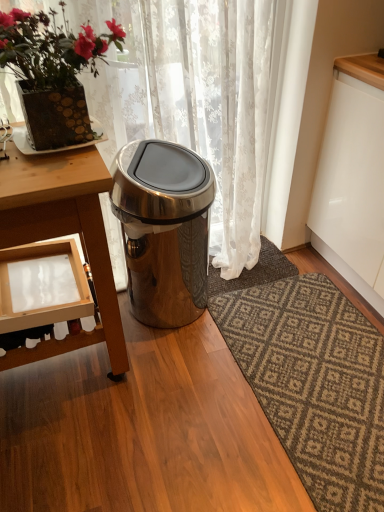
Question: Can you confirm if white lace curtain at upper center is smaller than dark gray textured rug at center?

Choices:
 (A) no
 (B) yes

Answer: (A)

Question: Can you confirm if white lace curtain at upper center is bigger than dark gray textured rug at center?

Choices:
 (A) no
 (B) yes

Answer: (B)

Question: Considering the relative sizes of white lace curtain at upper center and dark gray textured rug at center in the image provided, is white lace curtain at upper center thinner than dark gray textured rug at center?

Choices:
 (A) yes
 (B) no

Answer: (A)

Question: From the image's perspective, is white lace curtain at upper center located above dark gray textured rug at center?

Choices:
 (A) yes
 (B) no

Answer: (A)

Question: Are white lace curtain at upper center and dark gray textured rug at center located far from each other?

Choices:
 (A) yes
 (B) no

Answer: (B)

Question: From the image's perspective, is matte gold pot at upper left positioned above or below satin silver trash can at center?

Choices:
 (A) below
 (B) above

Answer: (B)

Question: Looking at their shapes, would you say matte gold pot at upper left is wider or thinner than satin silver trash can at center?

Choices:
 (A) thin
 (B) wide

Answer: (B)

Question: In the image, is matte gold pot at upper left positioned in front of or behind satin silver trash can at center?

Choices:
 (A) behind
 (B) front

Answer: (B)

Question: Is point (59, 47) closer or farther from the camera than point (147, 266)?

Choices:
 (A) farther
 (B) closer

Answer: (B)

Question: Considering the positions of satin silver trash can at center and dark gray textured rug at center in the image, is satin silver trash can at center wider or thinner than dark gray textured rug at center?

Choices:
 (A) thin
 (B) wide

Answer: (B)

Question: Considering the positions of satin silver trash can at center and dark gray textured rug at center in the image, is satin silver trash can at center bigger or smaller than dark gray textured rug at center?

Choices:
 (A) small
 (B) big

Answer: (B)

Question: Considering their positions, is satin silver trash can at center located in front of or behind dark gray textured rug at center?

Choices:
 (A) behind
 (B) front

Answer: (B)

Question: Based on their positions, is satin silver trash can at center located to the left or right of dark gray textured rug at center?

Choices:
 (A) left
 (B) right

Answer: (A)

Question: Is satin silver trash can at center to the left or to the right of wooden table at left in the image?

Choices:
 (A) left
 (B) right

Answer: (B)

Question: Is satin silver trash can at center situated inside wooden table at left or outside?

Choices:
 (A) inside
 (B) outside

Answer: (B)